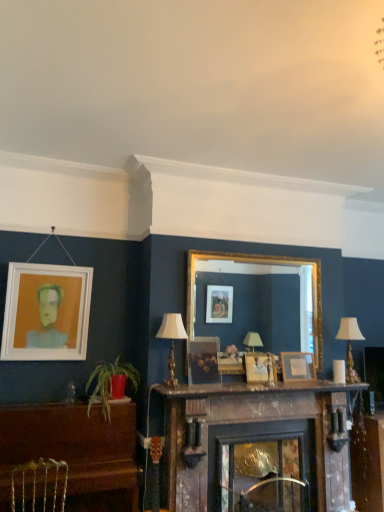
Question: Is green leafy plant at lower left inside the boundaries of wooden picture frame at center, positioned as the 1th picture frame in right-to-left order, or outside?

Choices:
 (A) inside
 (B) outside

Answer: (B)

Question: From the image's perspective, relative to wooden picture frame at center, the 4th picture frame in the left-to-right sequence, is green leafy plant at lower left above or below?

Choices:
 (A) above
 (B) below

Answer: (B)

Question: Estimate the real-world distances between objects in this image. Which object is closer to the dark wood fireplace at center?

Choices:
 (A) wooden picture frame at center, the 4th picture frame in the left-to-right sequence
 (B) wooden table at lower right
 (C) matte wooden picture frame at center, the third picture frame in the right-to-left sequence
 (D) wooden picture frame at center, arranged as the 2th picture frame when viewed from the right
 (E) white fabric lampshade at center, the 2th lamp in the back-to-front sequence

Answer: (D)

Question: Considering the real-world distances, which object is closest to the brown polished piano at lower left?

Choices:
 (A) dark wood fireplace at center
 (B) white matte picture frame at upper left, acting as the first picture frame starting from the left
 (C) white fabric lampshade at right, the 1th lamp when ordered from back to front
 (D) matte wooden picture frame at center, the third picture frame in the right-to-left sequence
 (E) wooden table at lower right

Answer: (B)